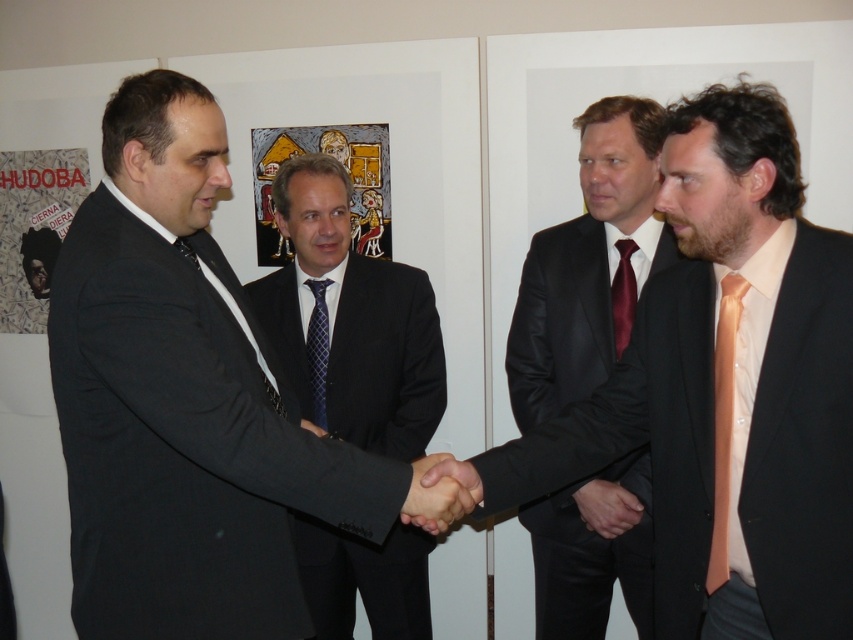
You are an interior designer observing the formal interaction between the two men in the room. You notice the orange silk tie at right. Can you determine its exact location in the room using the coordinate system provided?

The orange silk tie at right is located at point (723, 422) in the coordinate system.

You are a photographer standing 5 feet away from the two men in the scene. You want to capture a photo that includes both the matte black suit at center and the black leather suit at center in the same frame. Given your camera has a 50mm lens, which has a field of view that can capture about 45 degrees, can you fit both suits into the frame without moving closer or farther away?

The distance between the matte black suit at center and the black leather suit at center is 20.61 inches. Since the photographer is 5 feet away, the field of view at 50mm covers approximately 45 degrees. Using trigonometry, the maximum distance that can be captured in the frame is roughly 5 feet multiplied by the tangent of 22.5 degrees, which is about 2 feet or 24 inches. Since 20.61 inches is less than 24 inches, both suits can fit within the frame without moving closer or farther away.

Consider the image. You are a tailor observing two men in a formal setting. You notice the orange silk tie at right and the maroon satin tie at center. Which tie has a taller height?

The orange silk tie at right has a greater height compared to the maroon satin tie at center.